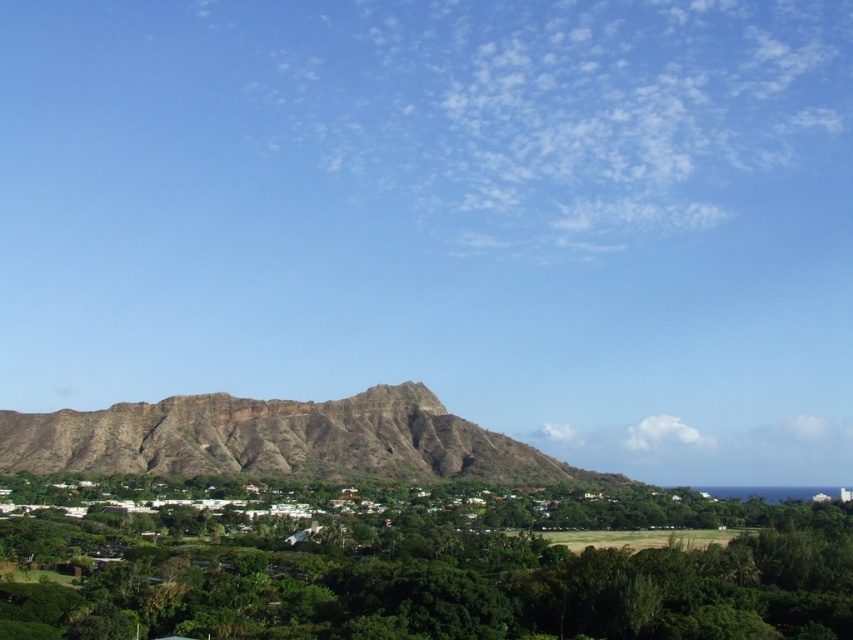
Question: Does green leafy tree at lower center have a larger size compared to brown rocky hillside at center?

Choices:
 (A) no
 (B) yes

Answer: (B)

Question: Which of the following is the closest to the observer?

Choices:
 (A) brown rocky hillside at center
 (B) green leafy tree at lower center

Answer: (B)

Question: Among these objects, which one is farthest from the camera?

Choices:
 (A) green leafy tree at lower center
 (B) brown rocky hillside at center

Answer: (B)

Question: Considering the relative positions of green leafy tree at lower center and brown rocky hillside at center in the image provided, where is green leafy tree at lower center located with respect to brown rocky hillside at center?

Choices:
 (A) left
 (B) right

Answer: (B)

Question: Can you confirm if green leafy tree at lower center is positioned to the left of brown rocky hillside at center?

Choices:
 (A) no
 (B) yes

Answer: (A)